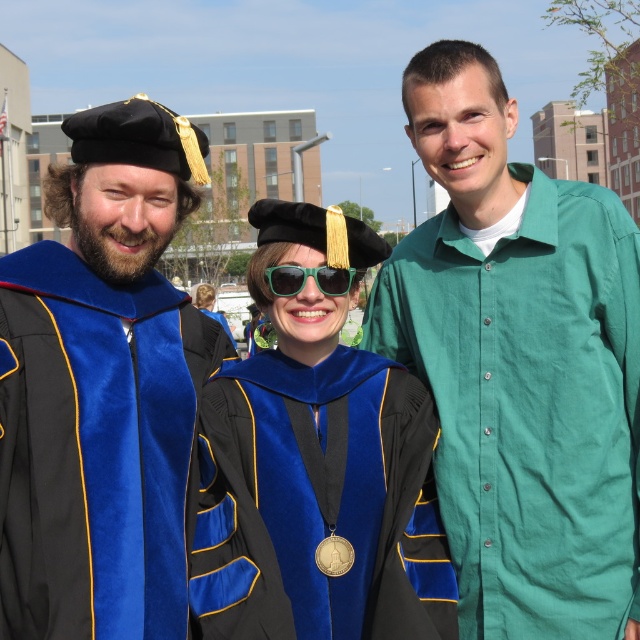
Question: Which point is closer to the camera taking this photo?

Choices:
 (A) (611, 509)
 (B) (275, 280)
 (C) (100, 524)

Answer: (C)

Question: Can you confirm if green cotton shirt at right is positioned to the right of velvet blue graduation gown at left?

Choices:
 (A) no
 (B) yes

Answer: (B)

Question: Does green cotton shirt at right come behind green plastic sunglasses at center?

Choices:
 (A) yes
 (B) no

Answer: (B)

Question: Among these points, which one is nearest to the camera?

Choices:
 (A) (324, 280)
 (B) (401, 636)
 (C) (83, 516)
 (D) (518, 276)

Answer: (C)

Question: Can you confirm if velvet blue graduation gown at left is smaller than velvet blue graduation gown at center?

Choices:
 (A) yes
 (B) no

Answer: (A)

Question: Which of the following is the farthest from the observer?

Choices:
 (A) (307, 275)
 (B) (8, 490)

Answer: (A)